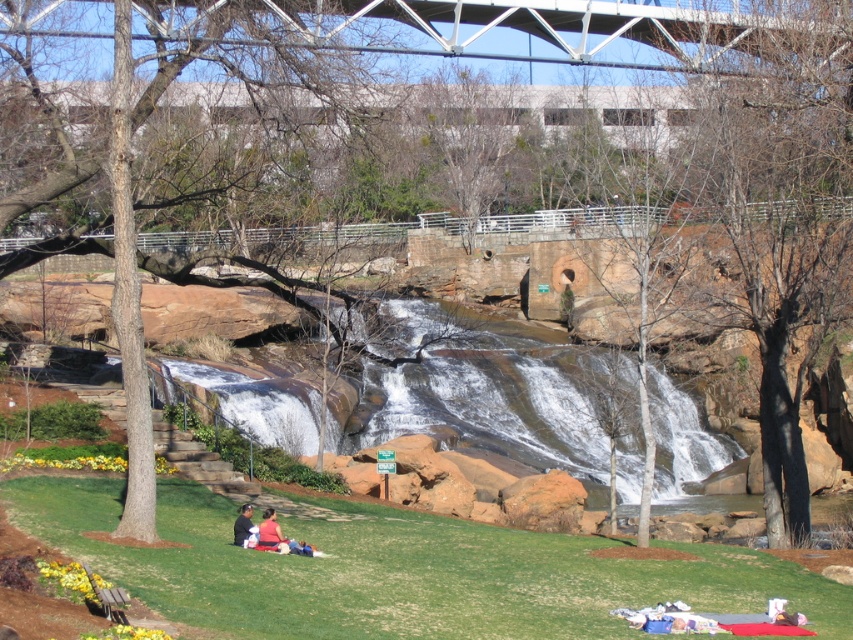
Question: Is white metallic bridge at upper center to the right of dark brown leather jacket at lower center from the viewer's perspective?

Choices:
 (A) yes
 (B) no

Answer: (A)

Question: Can you confirm if green grass at lower center is positioned to the right of matte pink shirt at lower center?

Choices:
 (A) yes
 (B) no

Answer: (A)

Question: Which of the following is the closest to the observer?

Choices:
 (A) white metallic bridge at upper center
 (B) dark brown leather jacket at lower center
 (C) green grass at lower center
 (D) clear water at center

Answer: (C)

Question: Can you confirm if white metallic bridge at upper center is smaller than dark brown leather jacket at lower center?

Choices:
 (A) yes
 (B) no

Answer: (B)

Question: Which point appears closest to the camera in this image?

Choices:
 (A) (579, 51)
 (B) (498, 360)

Answer: (B)

Question: Which point appears farthest from the camera in this image?

Choices:
 (A) (553, 570)
 (B) (242, 538)
 (C) (428, 406)
 (D) (732, 40)

Answer: (D)